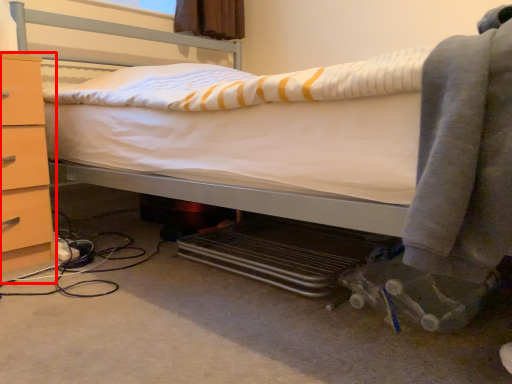
Question: From the image, what is the correct spatial relationship of chest of drawers (annotated by the red box) in relation to clothing?

Choices:
 (A) left
 (B) right

Answer: (A)